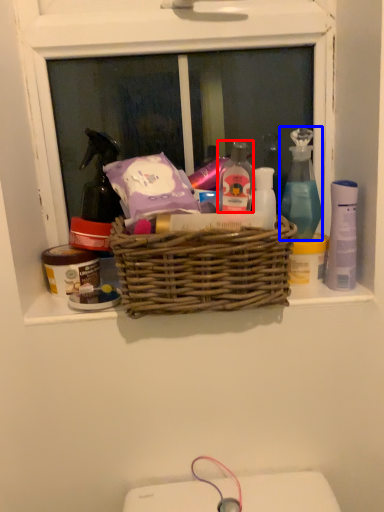
Question: Which object is closer to the camera taking this photo, toiletry (highlighted by a red box) or cleaning product (highlighted by a blue box)?

Choices:
 (A) toiletry
 (B) cleaning product

Answer: (A)